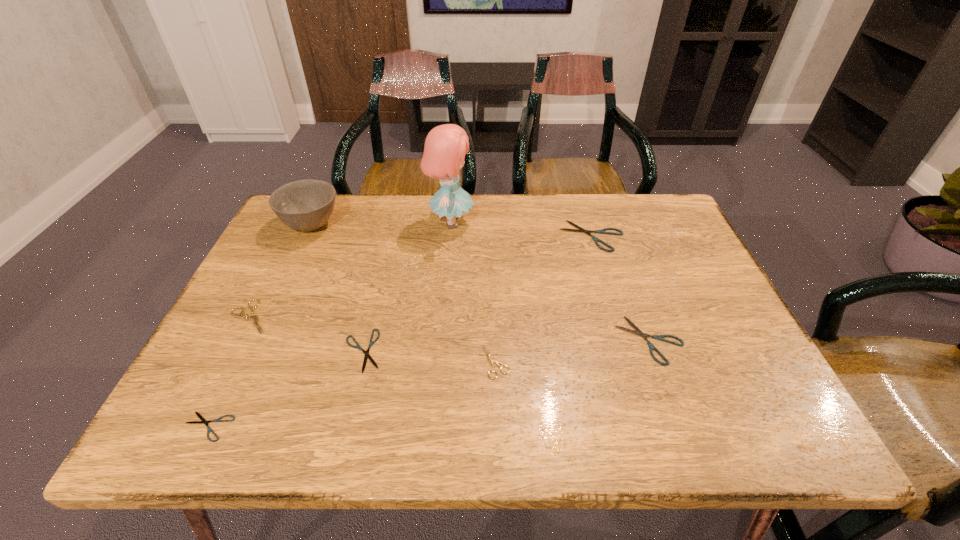
Where is `free space between the nearer beige shears and the bigger beige shears`? The image size is (960, 540). free space between the nearer beige shears and the bigger beige shears is located at coordinates (373, 339).

Find the location of a particular element. The width and height of the screenshot is (960, 540). free point between the farther beige shears and the farthest black shears is located at coordinates (421, 276).

The width and height of the screenshot is (960, 540). Find the location of `free space between the fourth object from left to right and the farthest shears`. free space between the fourth object from left to right and the farthest shears is located at coordinates (477, 293).

This screenshot has width=960, height=540. In order to click on empty space that is in between the seventh shortest object and the nearer beige shears in this screenshot , I will do `click(403, 293)`.

Find the location of a particular element. empty space between the third smallest black shears and the fourth object from right to left is located at coordinates [550, 281].

At what (x,y) coordinates should I click in order to perform the action: click on unoccupied area between the third smallest black shears and the left beige shears. Please return your answer as a coordinate pair (x, y). Looking at the image, I should click on (450, 328).

Where is `the fifth closest object to the sixth object from left to right`? The image size is (960, 540). the fifth closest object to the sixth object from left to right is located at coordinates (203, 420).

This screenshot has width=960, height=540. I want to click on object that is the third closest to the doll, so click(x=371, y=342).

You are a GUI agent. You are given a task and a screenshot of the screen. Output one action in this format:
    pyautogui.click(x=<x>, y=<y>)
    Task: Click on the shears that stands as the second closest to the bigger beige shears
    
    Given the screenshot: What is the action you would take?
    pyautogui.click(x=203, y=420)

Select which shears appears as the fourth closest to the right beige shears. Please provide its 2D coordinates. Your answer should be formatted as a tuple, i.e. [(x, y)], where the tuple contains the x and y coordinates of a point satisfying the conditions above.

[(203, 420)]